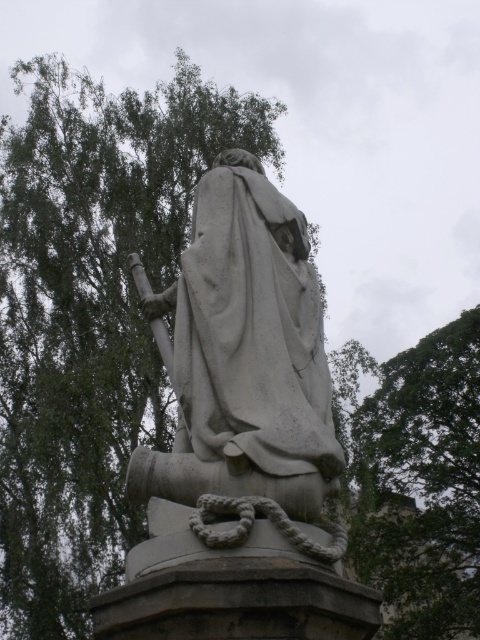
You are a photographer standing at a certain distance from the white stone statue at center. You want to capture a full view of the statue without any cropping. Your camera has a standard lens with a focal length of 50mm. According to the rule of thumb, the minimum distance required to photograph a statue of height 2 meters without cropping is 2.5 meters. Is your current distance sufficient to avoid cropping the statue in the photo?

The white stone statue at center and camera are 30.56 meters apart. Since 30.56 meters is greater than the minimum required 2.5 meters, your current distance is sufficient to avoid cropping the statue in the photo.

You are an artist sketching the scene and want to capture the relative positions of the green leafy tree at upper left and the white stone statue at center. Which object is located to the left of the other?

The green leafy tree at upper left is positioned on the left side of white stone statue at center.

You are standing in front of the stone statue and want to place two markers on the ground. The first marker should be at point (19, 253) and the second at point (361, 456). From your current position, which marker will appear closer to you?

Point (19, 253) is in front of point (361, 456), so the first marker at point (19, 253) will appear closer to you.